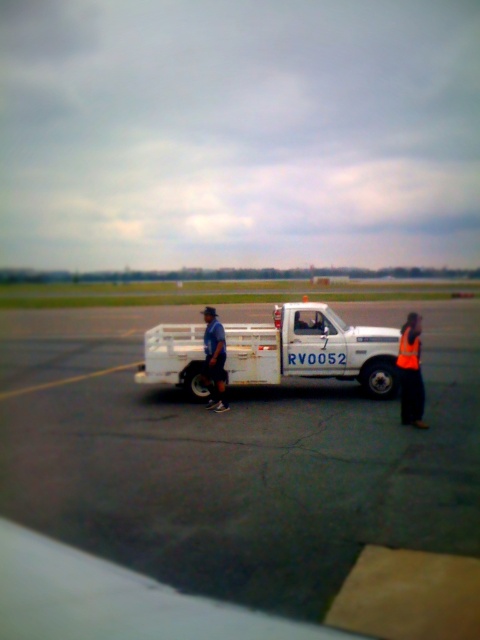
Is white smooth tarmac at center positioned in front of orange fabric safety vest at right?

Yes, it is in front of orange fabric safety vest at right.

In the scene shown: Does white smooth tarmac at center have a smaller size compared to orange fabric safety vest at right?

No.

Identify the location of white smooth tarmac at center. [x=236, y=458].

Who is lower down, white matte truck at center or blue fabric shirt at center?

white matte truck at center is below.

Describe the element at coordinates (312, 349) in the screenshot. I see `white matte truck at center` at that location.

Is point (197, 326) positioned behind point (210, 378)?

That is True.

I want to click on white matte truck at center, so click(312, 349).

Who is positioned more to the left, white smooth tarmac at center or white matte truck at center?

white matte truck at center

Does point (383, 538) come closer to viewer compared to point (235, 323)?

Yes, it is.

Is point (159, 561) behind point (355, 326)?

No, it is not.

Where is `white smooth tarmac at center`? white smooth tarmac at center is located at coordinates pyautogui.click(x=236, y=458).